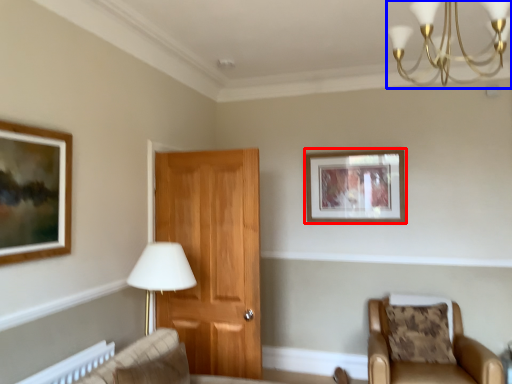
Question: Which of the following is the farthest to the observer, picture frame (highlighted by a red box) or light fixture (highlighted by a blue box)?

Choices:
 (A) picture frame
 (B) light fixture

Answer: (A)